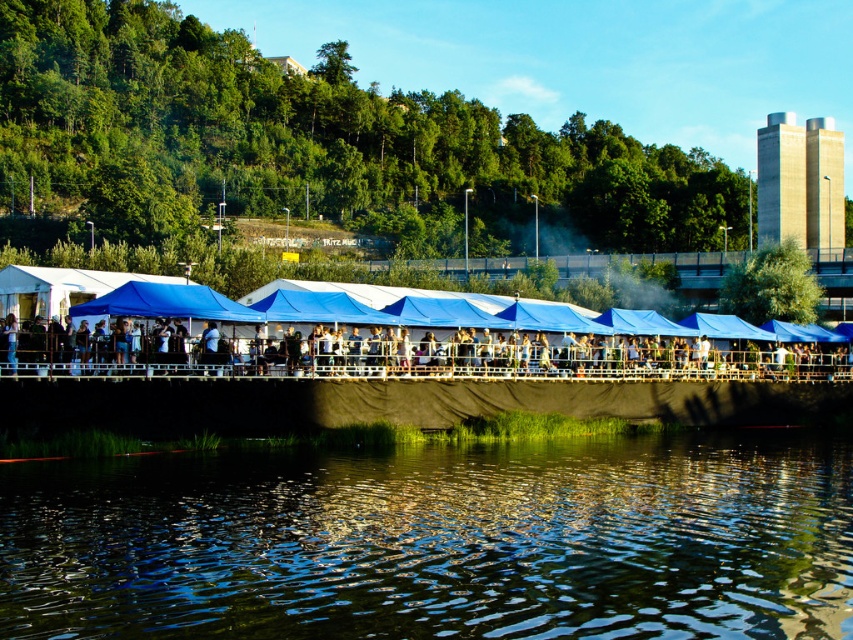
You are a photographer trying to capture the reflection of the white fabric tent at center in the green reflective water at lower center. Based on the scene, can you confirm if the tent is visible in the water?

The green reflective water at lower center is positioned under the white fabric tent at center, so the reflection of the white fabric tent at center would appear in the green reflective water at lower center.